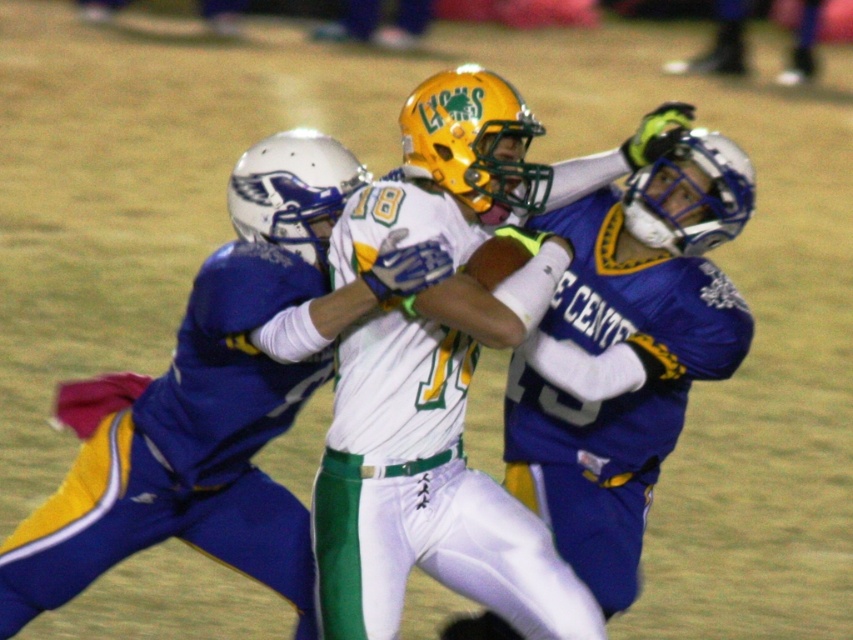
Question: Which of the following is the farthest from the observer?

Choices:
 (A) blue jersey at center
 (B) white matte helmet at center

Answer: (A)

Question: Is white matte helmet at center closer to the viewer compared to blue jersey at center?

Choices:
 (A) no
 (B) yes

Answer: (B)

Question: Is white matte helmet at center closer to the viewer compared to blue jersey at center?

Choices:
 (A) yes
 (B) no

Answer: (A)

Question: Does white matte helmet at center have a lesser width compared to blue jersey at center?

Choices:
 (A) yes
 (B) no

Answer: (B)